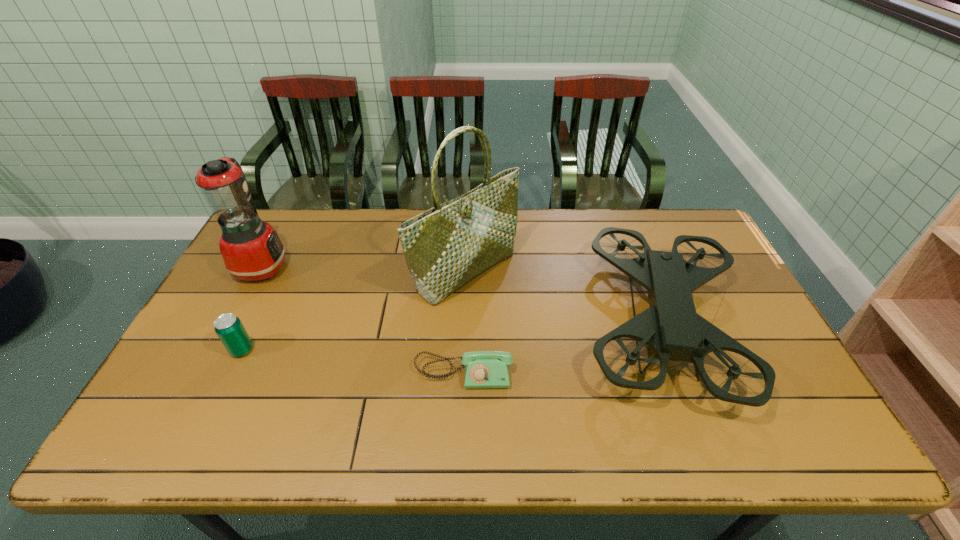
Locate an element on the screen. The image size is (960, 540). free spot located on the dial of the shortest object is located at coordinates (462, 432).

Find the location of a particular element. The width and height of the screenshot is (960, 540). shopping bag that is at the far edge is located at coordinates (447, 246).

Find the location of a particular element. This screenshot has width=960, height=540. food processor at the far edge is located at coordinates (251, 249).

At what (x,y) coordinates should I click in order to perform the action: click on drone present at the far edge. Please return your answer as a coordinate pair (x, y). Looking at the image, I should click on (670, 326).

Identify the location of object that is at the near edge. Image resolution: width=960 pixels, height=540 pixels. (670, 326).

Find the location of a particular element. The height and width of the screenshot is (540, 960). food processor that is at the left edge is located at coordinates (251, 249).

What are the coordinates of `beer can at the left edge` in the screenshot? It's located at (229, 328).

Where is `object present at the right edge`? This screenshot has height=540, width=960. object present at the right edge is located at coordinates (670, 326).

Locate an element on the screen. object that is at the far left corner is located at coordinates (251, 249).

Locate an element on the screen. The width and height of the screenshot is (960, 540). object at the far right corner is located at coordinates (670, 326).